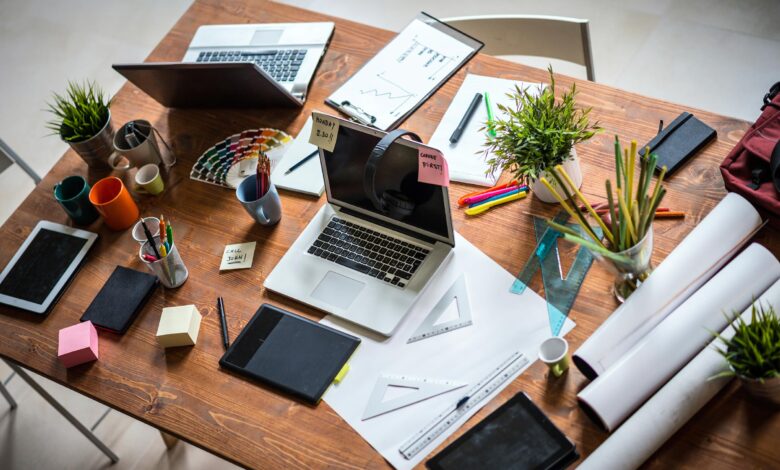
Find the location of `coffee mugs`. coffee mugs is located at coordinates (68, 202), (112, 209), (137, 152), (249, 210).